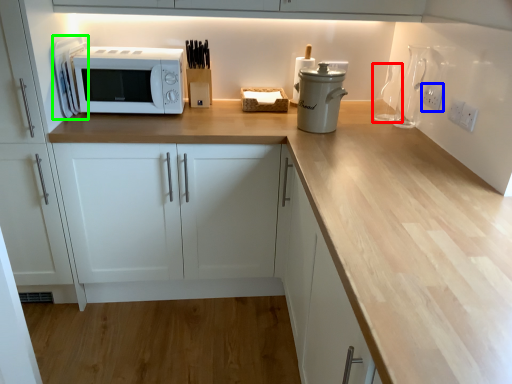
Question: Which is farther away from bottle (highlighted by a red box)? electric outlet (highlighted by a blue box) or appliance (highlighted by a green box)?

Choices:
 (A) electric outlet
 (B) appliance

Answer: (B)